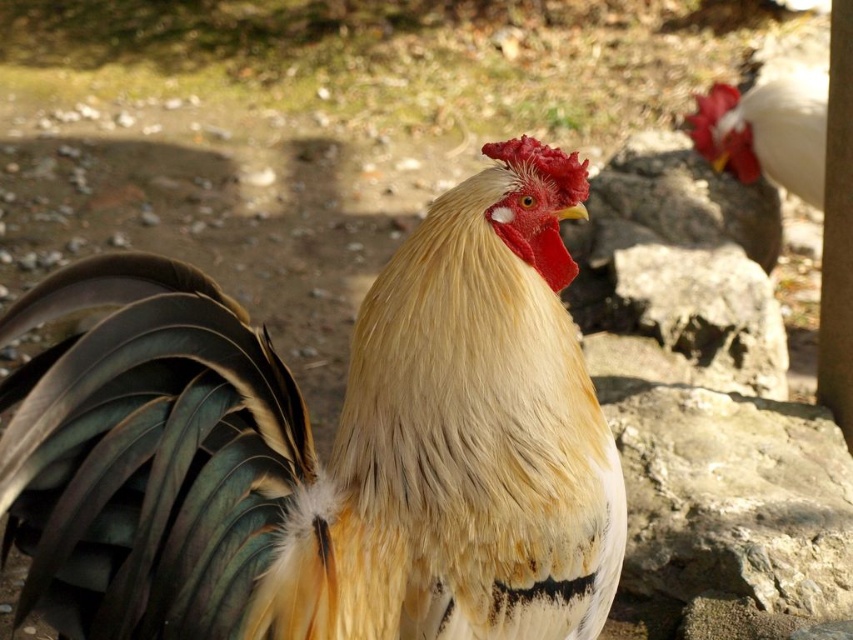
How distant is golden feathered rooster at center from white glossy rooster at upper right?

golden feathered rooster at center and white glossy rooster at upper right are 2.77 meters apart from each other.

Is point (398, 291) more distant than point (730, 148)?

No, it is not.

Identify the location of golden feathered rooster at center. (332, 445).